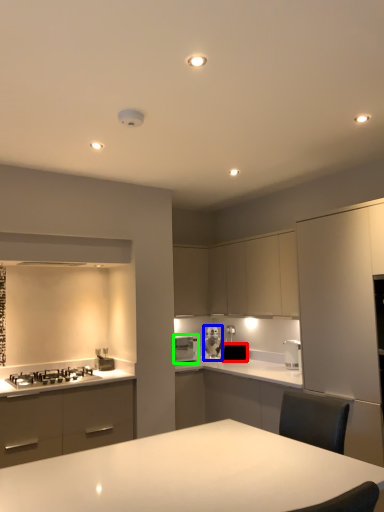
Question: Based on their relative distances, which object is nearer to appliance (highlighted by a red box)? Choose from kitchen appliance (highlighted by a blue box) and kitchen appliance (highlighted by a green box).

Choices:
 (A) kitchen appliance
 (B) kitchen appliance

Answer: (A)